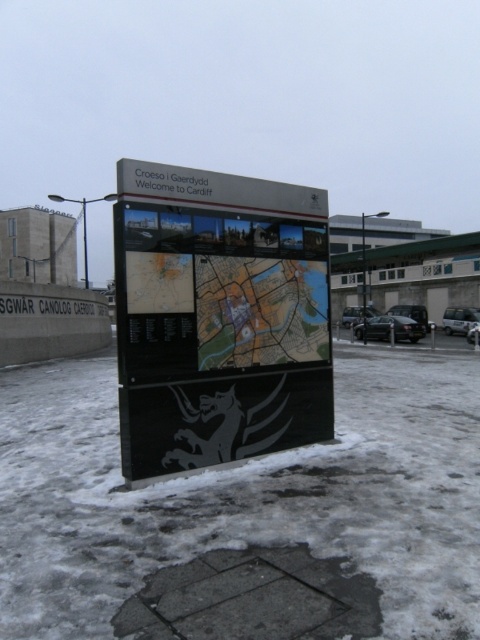
You are standing in front of the signboard and want to touch both the point at location (204,298) and the point at (381,339). Which point will you reach first?

The point at location (204,298) is closer to the viewer than the point at (381,339), so you will reach the point at (204,298) first.

You are a visitor to Cardiff and want to park your car. You see the white powdery snow at lower center and the black asphalt parking lot at lower right. Which one is a suitable place to park your car?

The black asphalt parking lot at lower right is a suitable place to park your car because the white powdery snow at lower center is not as tall as the parking lot, suggesting it might be too soft or unstable for parking.